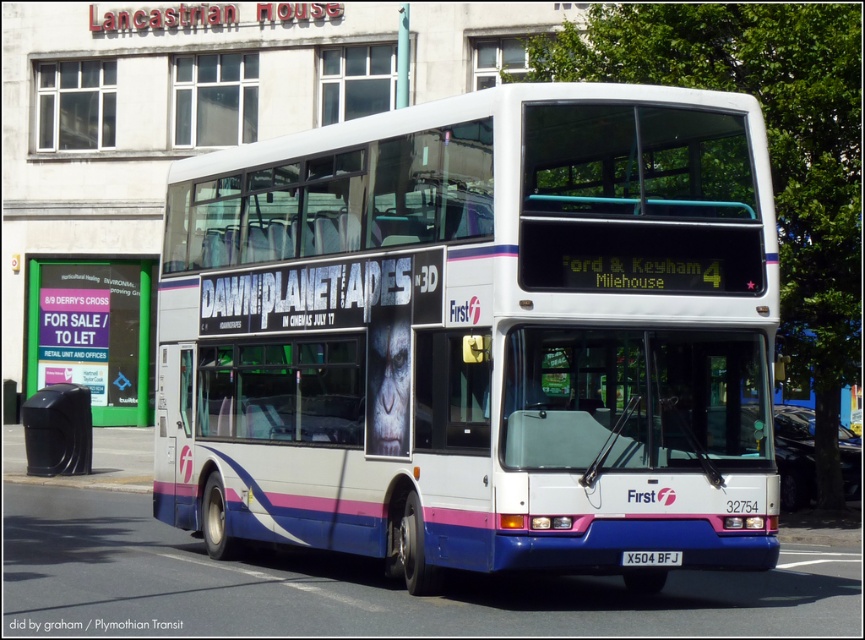
Question: Does white glossy decker bus at center appear on the left side of black plastic trash can at lower left?

Choices:
 (A) yes
 (B) no

Answer: (B)

Question: Considering the real-world distances, which object is closest to the black plastic trash can at lower left?

Choices:
 (A) white glossy decker bus at center
 (B) white plastic license plate at center

Answer: (A)

Question: Can you confirm if black plastic trash can at lower left is positioned above white plastic license plate at center?

Choices:
 (A) yes
 (B) no

Answer: (A)

Question: Which point is closer to the camera?

Choices:
 (A) (626, 564)
 (B) (492, 385)
 (C) (82, 426)

Answer: (A)

Question: Which of the following is the farthest from the observer?

Choices:
 (A) white glossy decker bus at center
 (B) white plastic license plate at center
 (C) black plastic trash can at lower left

Answer: (C)

Question: Is white glossy decker bus at center closer to camera compared to black plastic trash can at lower left?

Choices:
 (A) no
 (B) yes

Answer: (B)